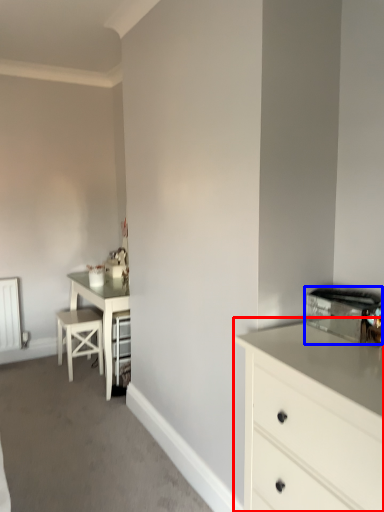
Question: Which point is further to the camera, chest of drawers (highlighted by a red box) or appliance (highlighted by a blue box)?

Choices:
 (A) chest of drawers
 (B) appliance

Answer: (B)